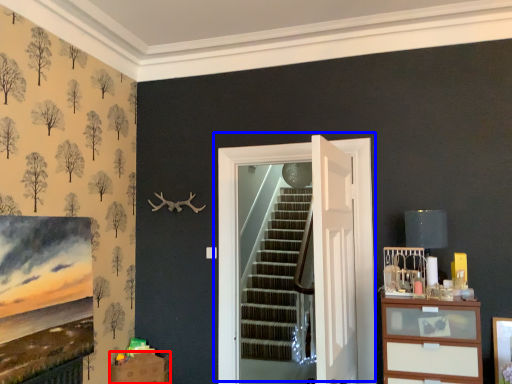
Question: Which object is closer to the camera taking this photo, drawer (highlighted by a red box) or door (highlighted by a blue box)?

Choices:
 (A) drawer
 (B) door

Answer: (B)